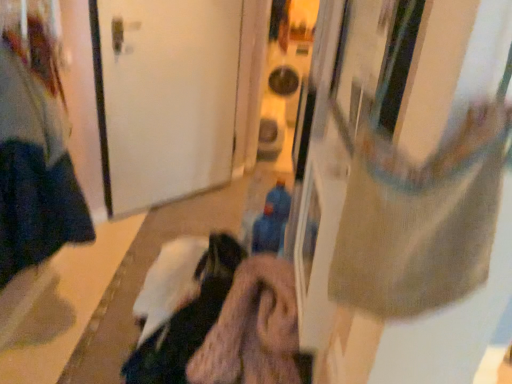
Question: Is white matte door at center closer to camera compared to blue fabric toy at center?

Choices:
 (A) no
 (B) yes

Answer: (A)

Question: Would you say white matte door at center is a long distance from blue fabric toy at center?

Choices:
 (A) yes
 (B) no

Answer: (A)

Question: Does white matte door at center appear on the right side of blue fabric toy at center?

Choices:
 (A) yes
 (B) no

Answer: (B)

Question: Is white matte door at center further to the viewer compared to blue fabric toy at center?

Choices:
 (A) no
 (B) yes

Answer: (B)

Question: Is white matte door at center not within blue fabric toy at center?

Choices:
 (A) no
 (B) yes

Answer: (B)

Question: Is dark blue fabric at left wider or thinner than white matte door at center?

Choices:
 (A) thin
 (B) wide

Answer: (B)

Question: Considering the positions of dark blue fabric at left and white matte door at center in the image, is dark blue fabric at left taller or shorter than white matte door at center?

Choices:
 (A) tall
 (B) short

Answer: (B)

Question: From the image's perspective, is dark blue fabric at left located above or below white matte door at center?

Choices:
 (A) below
 (B) above

Answer: (A)

Question: Does point (0, 120) appear closer or farther from the camera than point (117, 64)?

Choices:
 (A) farther
 (B) closer

Answer: (B)

Question: Choose the correct answer: Is dark blue fabric at left inside blue fabric toy at center or outside it?

Choices:
 (A) inside
 (B) outside

Answer: (B)

Question: From a real-world perspective, is dark blue fabric at left positioned above or below blue fabric toy at center?

Choices:
 (A) above
 (B) below

Answer: (A)

Question: From the image's perspective, relative to blue fabric toy at center, is dark blue fabric at left above or below?

Choices:
 (A) below
 (B) above

Answer: (B)

Question: Considering the positions of point [17, 104] and point [266, 228], is point [17, 104] closer or farther from the camera than point [266, 228]?

Choices:
 (A) closer
 (B) farther

Answer: (B)

Question: Is blue fabric toy at center inside the boundaries of dark blue fabric at left, or outside?

Choices:
 (A) inside
 (B) outside

Answer: (B)

Question: In the image, is blue fabric toy at center on the left side or the right side of dark blue fabric at left?

Choices:
 (A) left
 (B) right

Answer: (B)